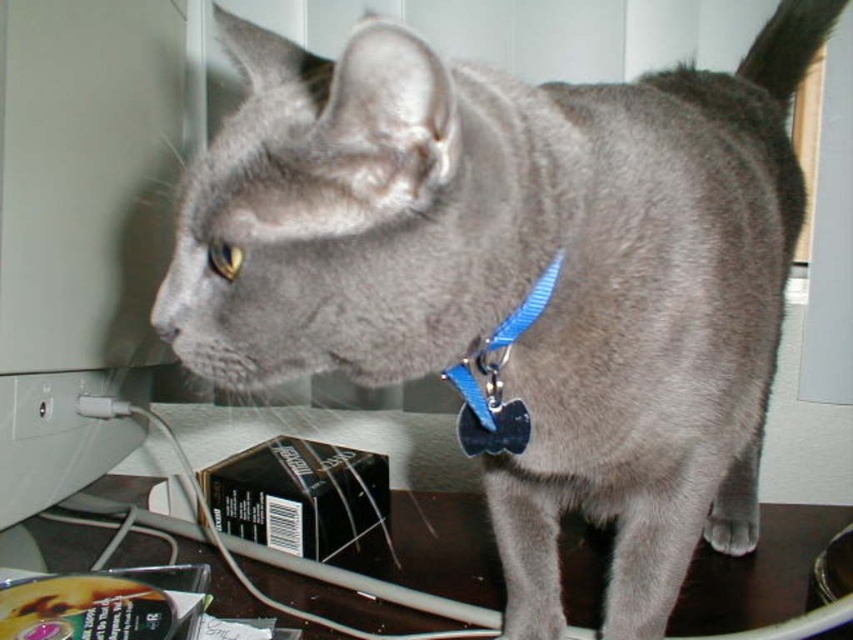
You are trying to locate the brown wood computer desk at lower center in the image. According to the coordinates provided, what is its exact position?

The brown wood computer desk at lower center is located at coordinates point (291, 556).

You are a delivery robot entering a room and need to place a package on the brown wood computer desk at lower center. However, there is a blue plastic tag at center in the way. Can you place the package directly on the desk without moving the tag?

The brown wood computer desk at lower center is positioned under the blue plastic tag at center, meaning the tag is above the desk. Therefore, you can place the package directly on the desk without needing to move the tag as it is not on the desk surface but above it.

You are a delivery robot trying to place a package on the surface where the gray cat is standing. The package needs to be placed at the point with coordinates point (291, 556). Is this point located on the brown wood computer desk at lower center?

Yes, the point (291, 556) corresponds to the brown wood computer desk at lower center, so the package can be placed there.